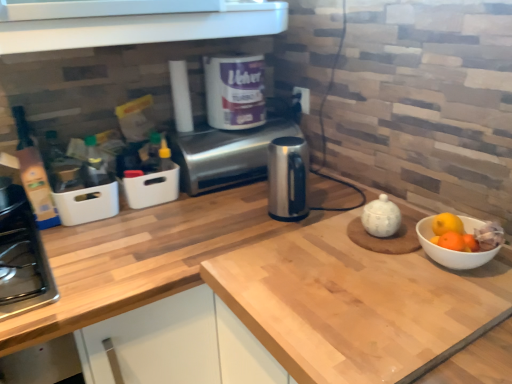
At what (x,y) coordinates should I click in order to perform the action: click on free space in front of white glossy tea pot at center-right. Please return your answer as a coordinate pair (x, y). Looking at the image, I should click on (392, 284).